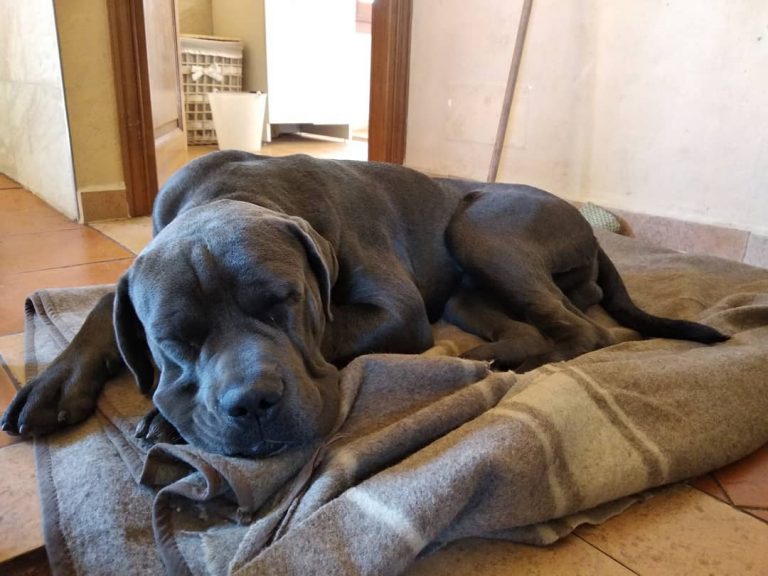
At what (x,y) coordinates should I click in order to perform the action: click on white basket. Please return your answer as a coordinate pair (x, y). The width and height of the screenshot is (768, 576). Looking at the image, I should click on pos(232,126).